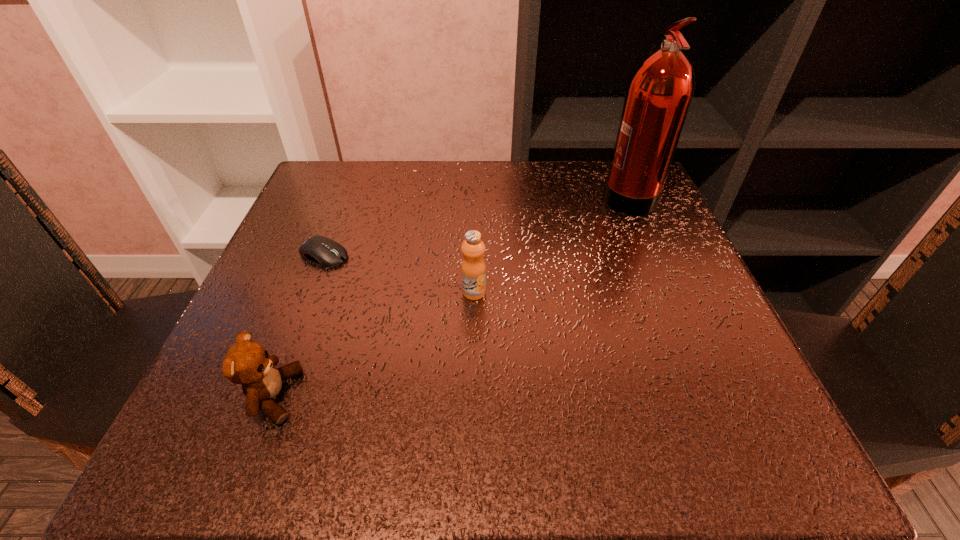
Image resolution: width=960 pixels, height=540 pixels. Identify the location of the tallest object. click(659, 93).

Locate an element on the screen. The width and height of the screenshot is (960, 540). the rightmost object is located at coordinates (659, 93).

Image resolution: width=960 pixels, height=540 pixels. I want to click on the third farthest object, so click(473, 267).

At what (x,y) coordinates should I click in order to perform the action: click on orange juice. Please return your answer as a coordinate pair (x, y). Looking at the image, I should click on (473, 267).

Find the location of a particular element. teddy bear is located at coordinates (248, 363).

The image size is (960, 540). I want to click on the second farthest object, so click(326, 252).

Identify the location of computer equipment. (326, 252).

The width and height of the screenshot is (960, 540). Find the location of `vacant space located 0.380m on the front-facing side of the farthest object`. vacant space located 0.380m on the front-facing side of the farthest object is located at coordinates (428, 194).

Find the location of `vacant region located on the front-facing side of the farthest object`. vacant region located on the front-facing side of the farthest object is located at coordinates (560, 194).

Image resolution: width=960 pixels, height=540 pixels. What are the coordinates of `free space located 0.250m on the front-facing side of the farthest object` in the screenshot? It's located at (488, 194).